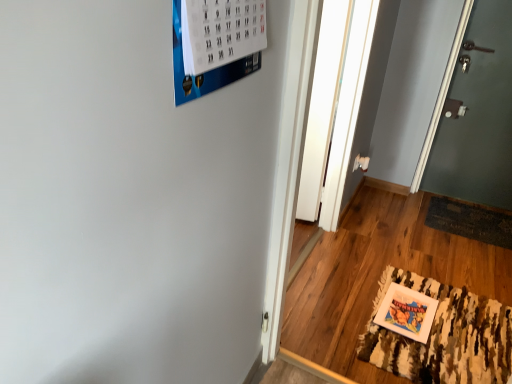
Find the location of a particular element. The height and width of the screenshot is (384, 512). free space behind camouflage-patterned rug at lower right is located at coordinates (411, 251).